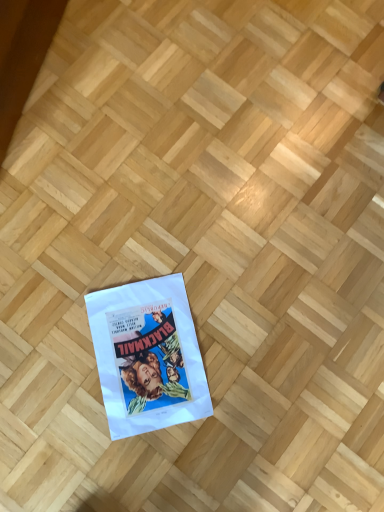
Image resolution: width=384 pixels, height=512 pixels. I want to click on spots to the right of white paper at center, so click(x=259, y=372).